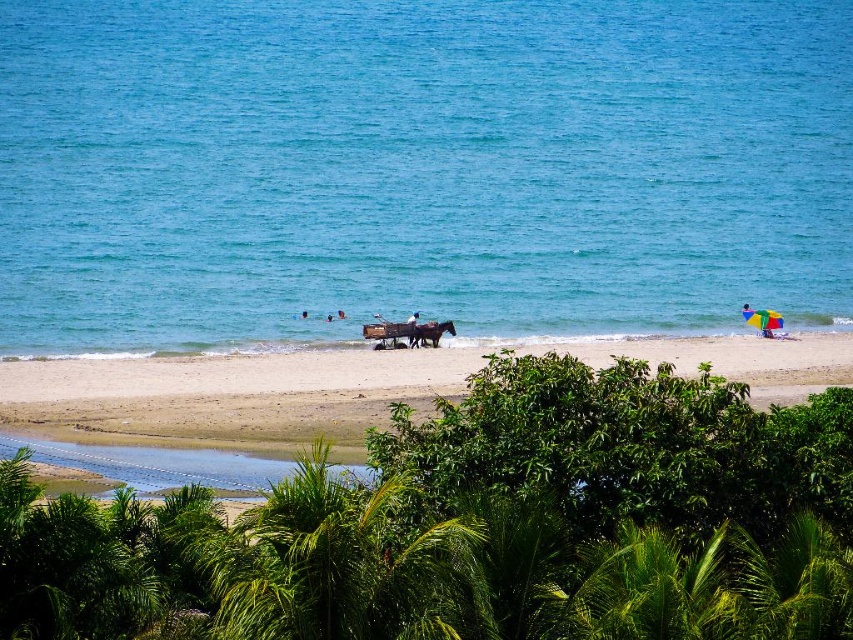
Is multicolored fabric umbrella at right positioned behind dark blue fabric at center?

Yes.

Is multicolored fabric umbrella at right to the left of dark blue fabric at center from the viewer's perspective?

In fact, multicolored fabric umbrella at right is to the right of dark blue fabric at center.

Who is more distant from viewer, (782, 321) or (412, 316)?

Point (782, 321)

The image size is (853, 640). Find the location of `multicolored fabric umbrella at right`. multicolored fabric umbrella at right is located at coordinates [x=764, y=321].

Measure the distance between blue water at center and camera.

blue water at center is 60.52 meters from camera.

What do you see at coordinates (418, 168) in the screenshot?
I see `blue water at center` at bounding box center [418, 168].

Who is more distant from viewer, (294, 124) or (743, 308)?

Point (294, 124)

At what (x,y) coordinates should I click in order to perform the action: click on blue water at center. Please return your answer as a coordinate pair (x, y). Looking at the image, I should click on (418, 168).

Does blue water at center appear on the left side of multicolored fabric umbrella at right?

Yes, blue water at center is to the left of multicolored fabric umbrella at right.

Can you confirm if blue water at center is thinner than multicolored fabric umbrella at right?

No.

This screenshot has height=640, width=853. I want to click on blue water at center, so click(x=418, y=168).